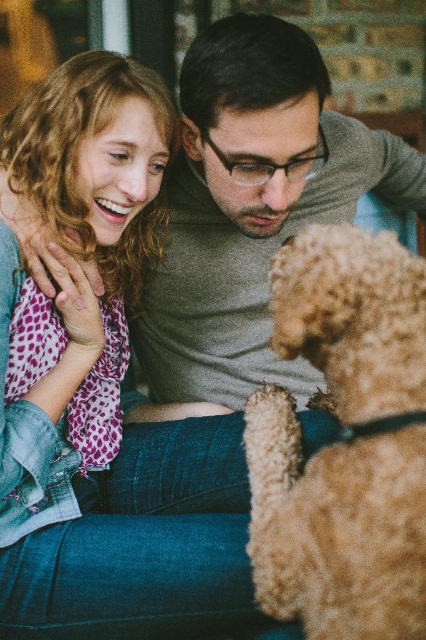
Between point (91, 308) and point (340, 166), which one is positioned in front?

Positioned in front is point (91, 308).

Identify the location of matte pink scarf at upper left. The height and width of the screenshot is (640, 426). (114, 508).

This screenshot has height=640, width=426. In order to click on matte pink scarf at upper left in this screenshot , I will do `click(114, 508)`.

Can you confirm if fuzzy golden dog at lower right is bigger than gray matte sweater at center?

Actually, fuzzy golden dog at lower right might be smaller than gray matte sweater at center.

Does fuzzy golden dog at lower right appear on the right side of gray matte sweater at center?

Correct, you'll find fuzzy golden dog at lower right to the right of gray matte sweater at center.

Is point (362, 506) closer to camera compared to point (275, 22)?

Yes, point (362, 506) is in front of point (275, 22).

Image resolution: width=426 pixels, height=640 pixels. What are the coordinates of `fuzzy golden dog at lower right` in the screenshot? It's located at (344, 442).

Is point (17, 524) closer to camera compared to point (342, 250)?

No.

This screenshot has width=426, height=640. What do you see at coordinates (114, 508) in the screenshot? I see `matte pink scarf at upper left` at bounding box center [114, 508].

This screenshot has height=640, width=426. Identify the location of matte pink scarf at upper left. (114, 508).